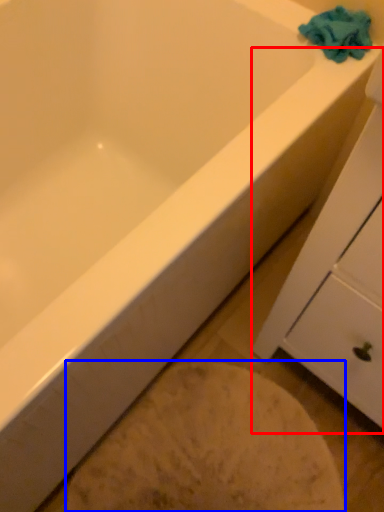
Question: Which object is further to the camera taking this photo, cabinetry (highlighted by a red box) or porcelain (highlighted by a blue box)?

Choices:
 (A) cabinetry
 (B) porcelain

Answer: (B)